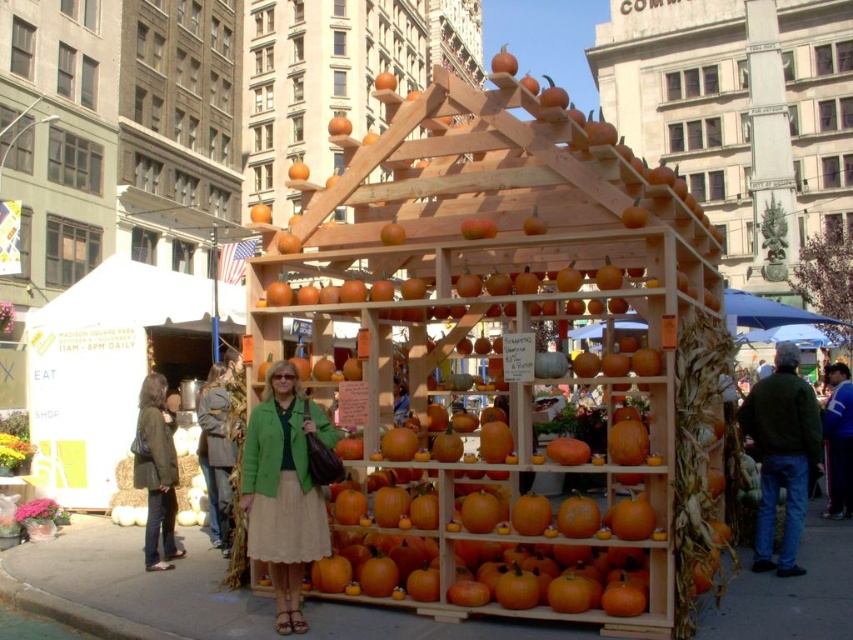
Question: Considering the relative positions of green fabric jacket at center and blue fleece jacket at lower right in the image provided, where is green fabric jacket at center located with respect to blue fleece jacket at lower right?

Choices:
 (A) right
 (B) left

Answer: (B)

Question: Among these points, which one is farthest from the camera?

Choices:
 (A) [851, 397]
 (B) [144, 412]

Answer: (A)

Question: Which point appears farthest from the camera in this image?

Choices:
 (A) click(x=770, y=532)
 (B) click(x=171, y=518)

Answer: (B)

Question: Can you confirm if green fabric jacket at center is positioned below blue fleece jacket at lower right?

Choices:
 (A) no
 (B) yes

Answer: (B)

Question: Which of the following is the farthest from the observer?

Choices:
 (A) (828, 500)
 (B) (144, 548)
 (C) (264, 387)
 (D) (788, 387)

Answer: (A)

Question: Observing the image, what is the correct spatial positioning of matte green jacket at lower left in reference to blue fleece jacket at lower right?

Choices:
 (A) above
 (B) below

Answer: (B)